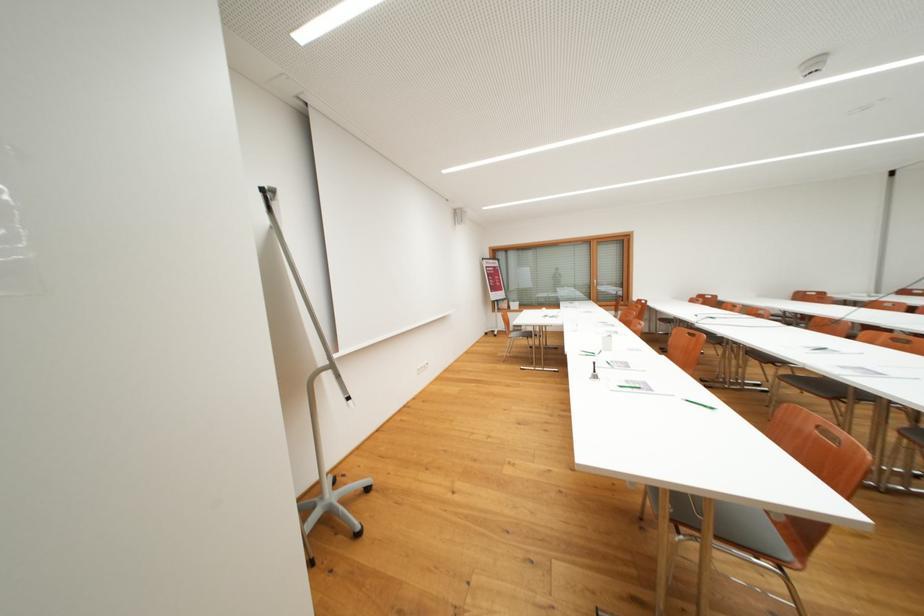
The height and width of the screenshot is (616, 924). In order to click on white paper booklet in this screenshot , I will do `click(636, 382)`.